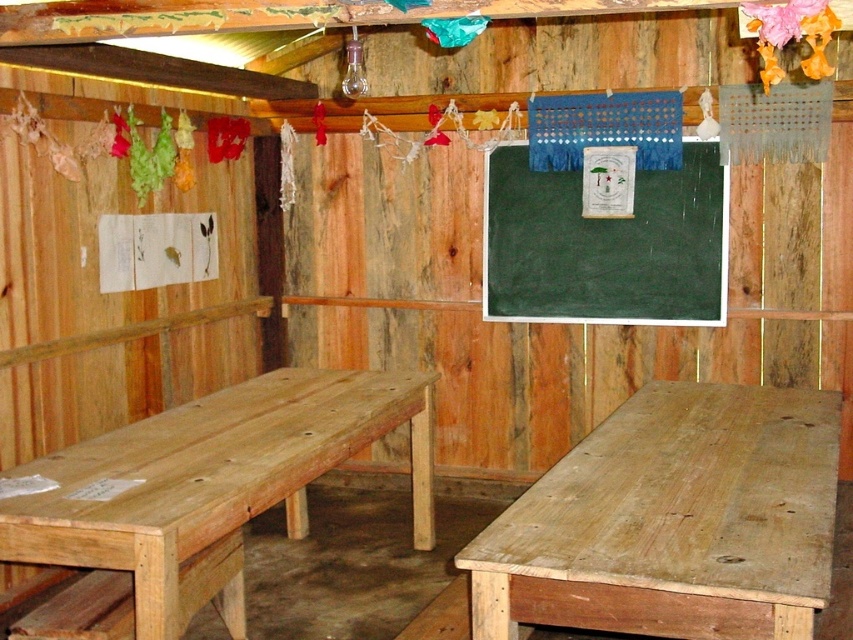
Question: Is natural wood picnic table at left closer to camera compared to green matte/blackboard at upper center?

Choices:
 (A) no
 (B) yes

Answer: (B)

Question: Considering the real-world distances, which object is closest to the green matte/blackboard at upper center?

Choices:
 (A) natural wood bench at lower left
 (B) natural wood picnic table at left

Answer: (B)

Question: Which point appears farthest from the camera in this image?

Choices:
 (A) (86, 580)
 (B) (125, 474)

Answer: (A)

Question: Does green matte/blackboard at upper center have a greater width compared to natural wood bench at lower left?

Choices:
 (A) yes
 (B) no

Answer: (A)

Question: Which of the following is the closest to the observer?

Choices:
 (A) wooden table at lower right
 (B) natural wood bench at lower left
 (C) green matte/blackboard at upper center

Answer: (A)

Question: From the image, what is the correct spatial relationship of natural wood picnic table at left in relation to natural wood bench at lower left?

Choices:
 (A) above
 (B) below

Answer: (A)